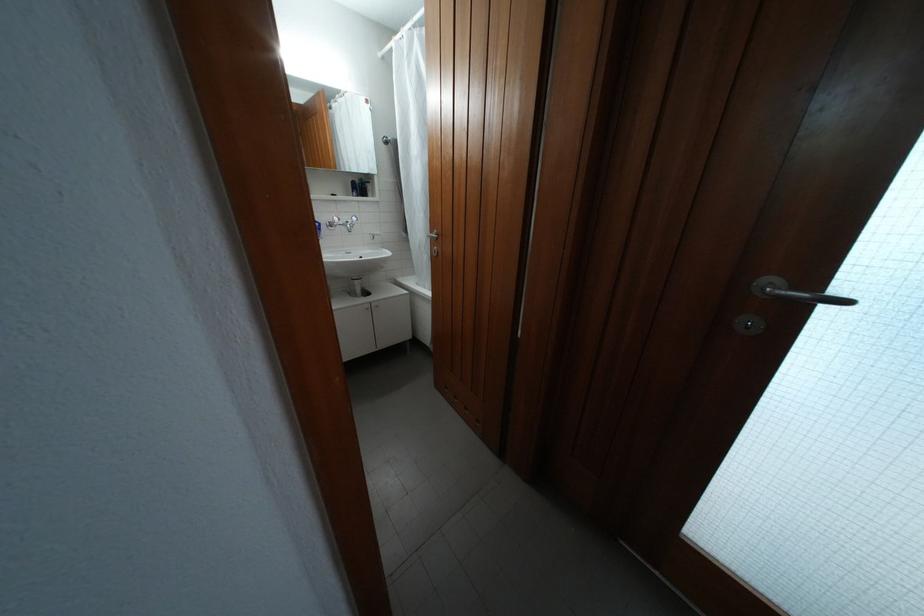
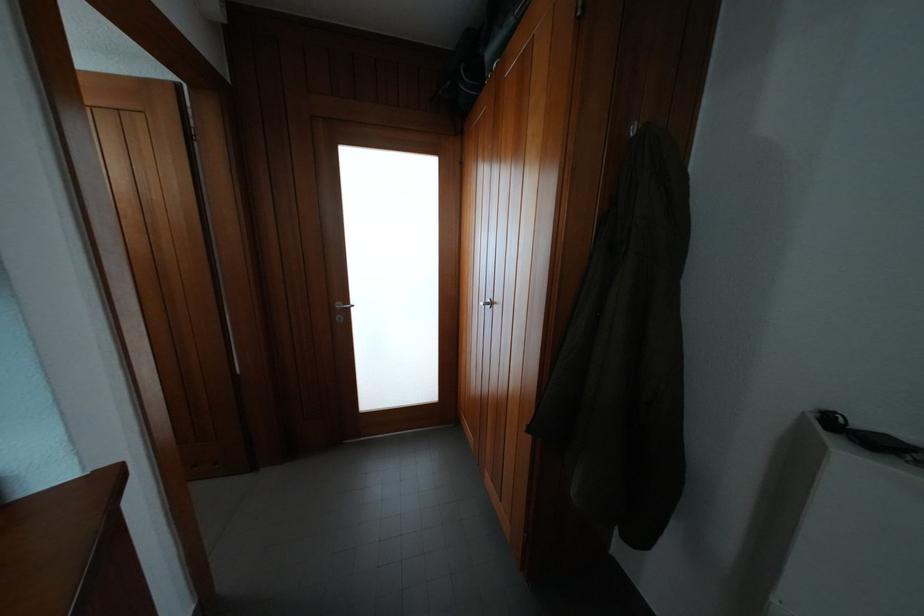
Question: The camera is either moving clockwise (left) or counter-clockwise (right) around the object. The first image is from the beginning of the video and the second image is from the end. Is the camera moving left or right when shooting the video?

Choices:
 (A) Left
 (B) Right

Answer: (A)